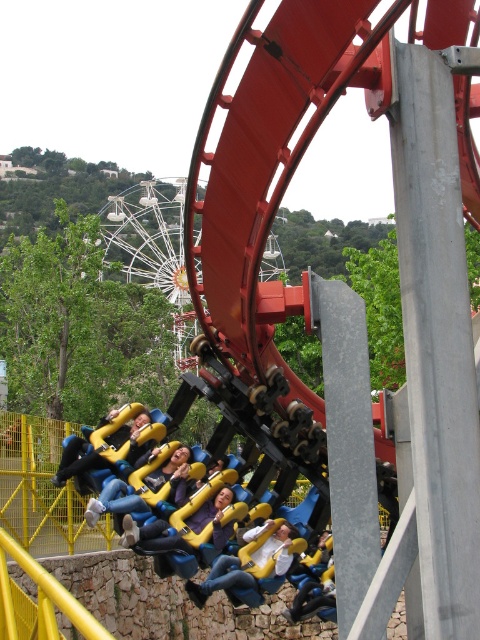
You are designing a new roller coaster seat arrangement and need to know about the seats in the image. Which of the two seats, the yellow fabric seat at center or the yellow plastic seat at center, has a greater width?

The yellow fabric seat at center has a greater width than the yellow plastic seat at center according to the description provided.

You are standing at the origin point of the roller coaster scene. Where is the denim jeans at center located in terms of coordinates?

The denim jeans at center is located at coordinates point (220, 579).

You are a photographer standing at the bottom of the roller coaster track. You want to take a photo of the denim jeans at center and the yellow fabric seat at center so that both are visible in the frame. Which object should you focus on first to ensure both are in focus?

You should focus on the yellow fabric seat at center first because it is taller than the denim jeans at center, allowing the photographer to capture both in focus by focusing on the taller object.